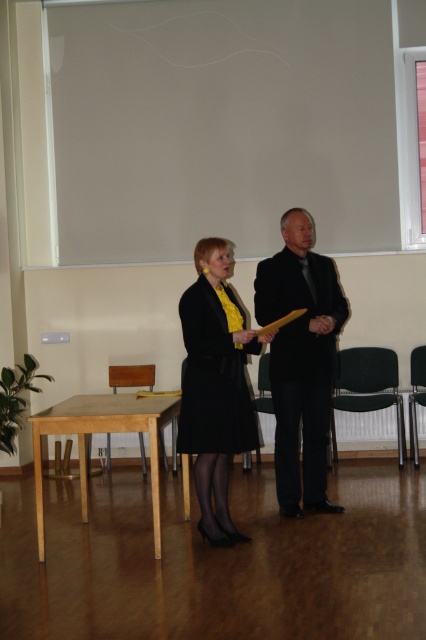
You are organizing a meeting in this room and need to seat two guests. You have a guest who prefers a wider chair. Which chair between the black plastic chair at lower right and the black plastic chair at center should they choose?

The black plastic chair at lower right is wider than the black plastic chair at center, so the guest should choose the black plastic chair at lower right.

You are organizing a meeting in this conference room and need to place a new table that is 1.2 meters wide. The table must be placed where the point at coordinates (367, 387) is located. Is there enough space to place the table there without blocking the black plastic chair at lower right?

The point at coordinates (367, 387) indicates the location of the black plastic chair at lower right. Placing a table here would directly block the black plastic chair at lower right, so it is not possible to place the table there without blocking it.